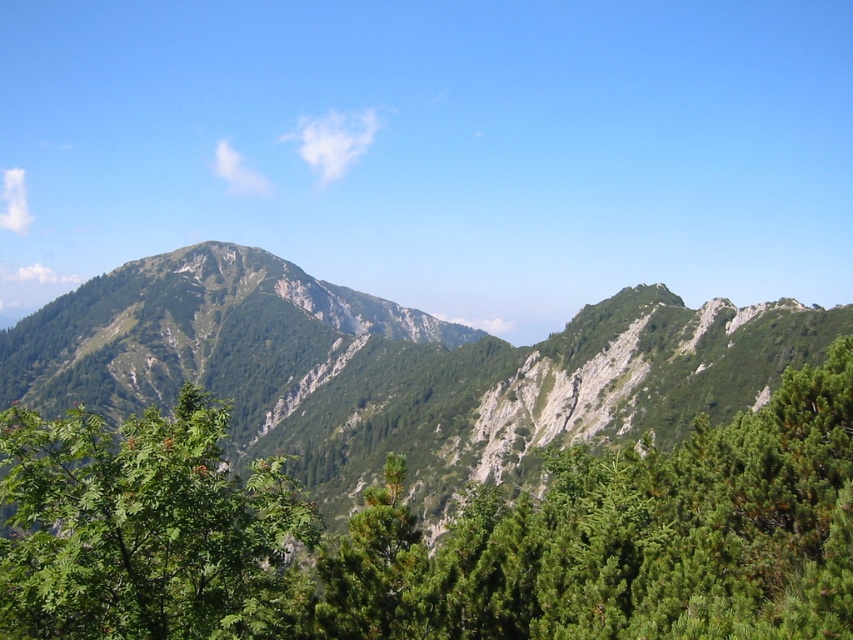
Question: Can you confirm if green rocky mountain range at center is smaller than green leafy tree at lower left?

Choices:
 (A) yes
 (B) no

Answer: (B)

Question: Is green rocky mountain range at center further to camera compared to green leafy tree at lower left?

Choices:
 (A) no
 (B) yes

Answer: (B)

Question: From the image, what is the correct spatial relationship of green rocky mountain range at center in relation to green leafy tree at lower left?

Choices:
 (A) right
 (B) left

Answer: (A)

Question: Which object is farther from the camera taking this photo?

Choices:
 (A) green rocky mountain range at center
 (B) green leafy tree at lower left

Answer: (A)

Question: Which point is closer to the camera?

Choices:
 (A) green leafy tree at lower left
 (B) green rocky mountain range at center

Answer: (A)